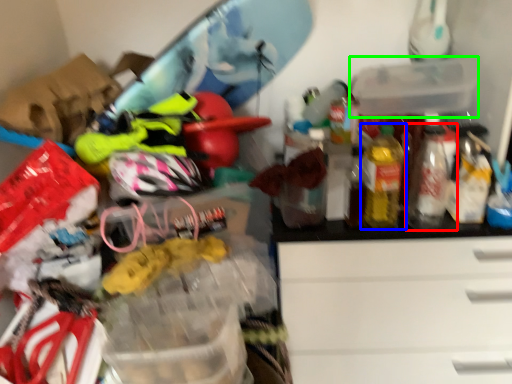
Question: Estimate the real-world distances between objects in this image. Which object is closer to bottle (highlighted by a red box), bottle (highlighted by a blue box) or storage box (highlighted by a green box)?

Choices:
 (A) bottle
 (B) storage box

Answer: (A)